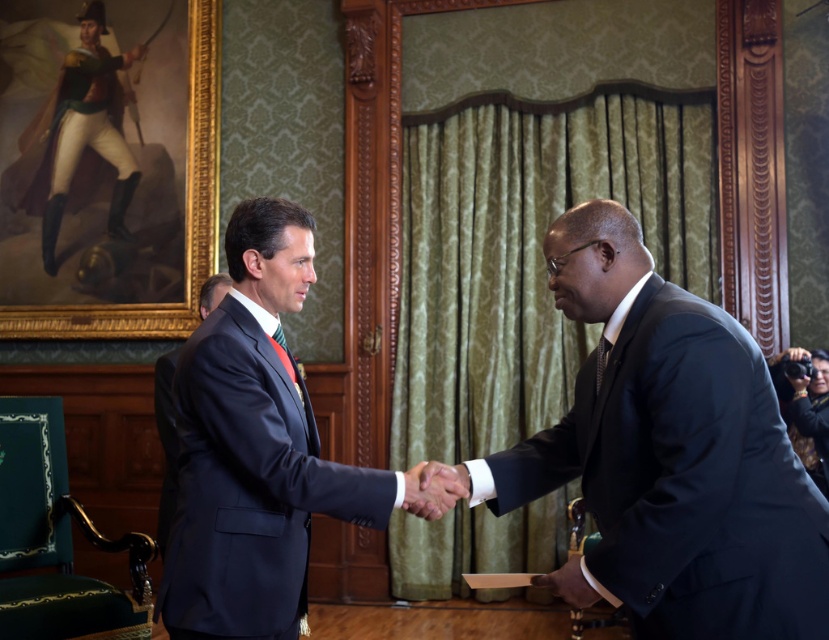
Question: Which point is farther from the camera taking this photo?

Choices:
 (A) (57, 152)
 (B) (449, 492)
 (C) (735, 470)
 (D) (251, 225)

Answer: (A)

Question: Among these objects, which one is farthest from the camera?

Choices:
 (A) dark blue suit at center
 (B) matte green uniform at upper left
 (C) white glossy hand at center
 (D) matte black suit at center

Answer: (B)

Question: Does matte black suit at center lie behind matte green uniform at upper left?

Choices:
 (A) no
 (B) yes

Answer: (A)

Question: Is dark blue suit at center below matte black suit at center?

Choices:
 (A) yes
 (B) no

Answer: (A)

Question: Does dark blue suit at center appear on the right side of white glossy hand at center?

Choices:
 (A) yes
 (B) no

Answer: (A)

Question: Which is farther from the white glossy hand at center?

Choices:
 (A) dark blue suit at center
 (B) matte green uniform at upper left

Answer: (B)